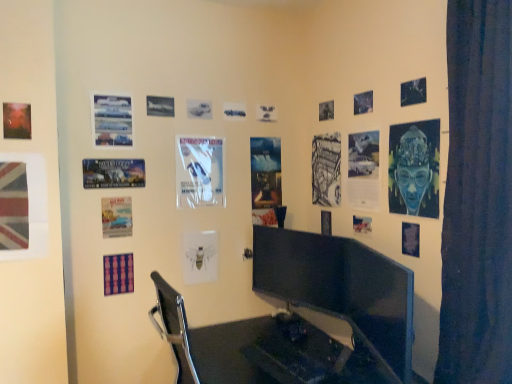
Question: Is white glossy poster at center, acting as the 9th poster page starting from the left, positioned in front of blue textured fabric at upper right, the sixteenth poster page positioned from the left?

Choices:
 (A) no
 (B) yes

Answer: (A)

Question: Is white glossy poster at center, which is counted as the 9th poster page, starting from the right, facing towards blue textured fabric at upper right, the sixteenth poster page positioned from the left?

Choices:
 (A) no
 (B) yes

Answer: (A)

Question: Is the surface of white glossy poster at center, acting as the 9th poster page starting from the left, in direct contact with blue textured fabric at upper right, the sixteenth poster page positioned from the left?

Choices:
 (A) no
 (B) yes

Answer: (A)

Question: Can we say white glossy poster at center, which is counted as the 9th poster page, starting from the right, lies outside blue textured fabric at upper right, the sixteenth poster page positioned from the left?

Choices:
 (A) yes
 (B) no

Answer: (A)

Question: Is white glossy poster at center, which is counted as the 9th poster page, starting from the right, thinner than blue textured fabric at upper right, which is the second poster page from right to left?

Choices:
 (A) no
 (B) yes

Answer: (A)

Question: Is white glossy poster at center, acting as the 9th poster page starting from the left, in front of or behind metallic poster at left, which is the fourth poster page from left to right, in the image?

Choices:
 (A) front
 (B) behind

Answer: (B)

Question: Based on their sizes in the image, would you say white glossy poster at center, acting as the 9th poster page starting from the left, is bigger or smaller than metallic poster at left, the fourteenth poster page positioned from the right?

Choices:
 (A) small
 (B) big

Answer: (B)

Question: Looking at their shapes, would you say white glossy poster at center, acting as the 9th poster page starting from the left, is wider or thinner than metallic poster at left, the fourteenth poster page positioned from the right?

Choices:
 (A) thin
 (B) wide

Answer: (B)

Question: Is point (180, 135) positioned closer to the camera than point (86, 178)?

Choices:
 (A) farther
 (B) closer

Answer: (A)

Question: Is white glossy poster at center, which is counted as the 9th poster page, starting from the right, in front of or behind union jack flag at left, arranged as the 1th poster page when viewed from the left, in the image?

Choices:
 (A) behind
 (B) front

Answer: (A)

Question: Is point (209, 147) positioned closer to the camera than point (34, 221)?

Choices:
 (A) closer
 (B) farther

Answer: (B)

Question: Is white glossy poster at center, acting as the 9th poster page starting from the left, wider or thinner than union jack flag at left, acting as the seventeenth poster page starting from the right?

Choices:
 (A) wide
 (B) thin

Answer: (A)

Question: From their relative heights in the image, would you say white glossy poster at center, which is counted as the 9th poster page, starting from the right, is taller or shorter than union jack flag at left, arranged as the 1th poster page when viewed from the left?

Choices:
 (A) tall
 (B) short

Answer: (A)

Question: Choose the correct answer: Is metallic airplane at upper center, positioned as the 11th poster page in right-to-left order, inside matte red poster at upper left, the second poster page in the left-to-right sequence, or outside it?

Choices:
 (A) outside
 (B) inside

Answer: (A)

Question: Is point (160, 107) closer or farther from the camera than point (20, 104)?

Choices:
 (A) closer
 (B) farther

Answer: (B)